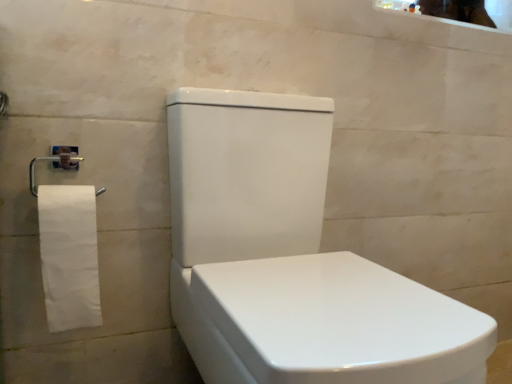
Question: Is point (58, 226) closer or farther from the camera than point (215, 258)?

Choices:
 (A) farther
 (B) closer

Answer: (B)

Question: From a real-world perspective, relative to white glossy toilet at center, is white matte toilet paper at left vertically above or below?

Choices:
 (A) below
 (B) above

Answer: (B)

Question: Which of these objects is positioned farthest from the white glossy toilet at center?

Choices:
 (A) glossy ceramic mirror at upper right
 (B) white matte toilet paper at left

Answer: (A)

Question: Based on their relative distances, which object is nearer to the glossy ceramic mirror at upper right?

Choices:
 (A) white matte toilet paper at left
 (B) white glossy toilet at center

Answer: (B)